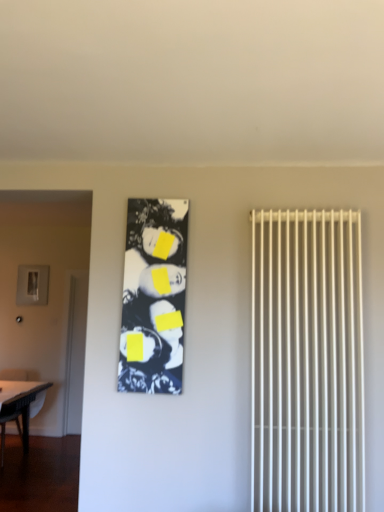
Image resolution: width=384 pixels, height=512 pixels. What do you see at coordinates (20, 405) in the screenshot?
I see `white glossy table at lower left` at bounding box center [20, 405].

Describe the element at coordinates (75, 353) in the screenshot. I see `matte gray screen door at left` at that location.

Where is `white glossy table at lower left`? The height and width of the screenshot is (512, 384). white glossy table at lower left is located at coordinates (20, 405).

Consider the image. Considering the relative sizes of white glossy table at lower left and white plastic radiator at right in the image provided, is white glossy table at lower left bigger than white plastic radiator at right?

Yes.

From a real-world perspective, is white glossy table at lower left positioned above or below white plastic radiator at right?

white glossy table at lower left is situated lower than white plastic radiator at right in the real world.

This screenshot has width=384, height=512. In order to click on table on the left of white plastic radiator at right in this screenshot , I will do `click(20, 405)`.

Between white glossy table at lower left and white plastic radiator at right, which one has less height?

Standing shorter between the two is white glossy table at lower left.

Does white plastic radiator at right have a greater width compared to black glossy photo frame at center?

Yes.

Is white plastic radiator at right not within black glossy photo frame at center?

Yes, white plastic radiator at right is outside of black glossy photo frame at center.

Considering the points (335, 246) and (161, 309), which point is in front, point (335, 246) or point (161, 309)?

Positioned in front is point (335, 246).

Considering the relative sizes of white glossy table at lower left and black glossy photo frame at center in the image provided, is white glossy table at lower left thinner than black glossy photo frame at center?

Incorrect, the width of white glossy table at lower left is not less than that of black glossy photo frame at center.

Considering the positions of objects white glossy table at lower left and black glossy photo frame at center in the image provided, who is more to the left, white glossy table at lower left or black glossy photo frame at center?

white glossy table at lower left.

Is the position of white glossy table at lower left more distant than that of black glossy photo frame at center?

Yes, white glossy table at lower left is further from the viewer.

Which of these two, white glossy table at lower left or black glossy photo frame at center, is bigger?

With larger size is white glossy table at lower left.

Visually, is white glossy table at lower left positioned to the left or to the right of matte gray screen door at left?

Clearly, white glossy table at lower left is on the left of matte gray screen door at left in the image.

In the scene shown: Based on their sizes in the image, would you say white glossy table at lower left is bigger or smaller than matte gray screen door at left?

Clearly, white glossy table at lower left is larger in size than matte gray screen door at left.

Is white glossy table at lower left facing towards matte gray screen door at left?

No, white glossy table at lower left is not aimed at matte gray screen door at left.

Is white glossy table at lower left closer to the viewer compared to matte gray screen door at left?

That is True.

Based on their sizes in the image, would you say matte gray screen door at left is bigger or smaller than white plastic radiator at right?

In the image, matte gray screen door at left appears to be smaller than white plastic radiator at right.

From the image's perspective, is matte gray screen door at left below white plastic radiator at right?

Yes.

Which object is wider, matte gray screen door at left or white plastic radiator at right?

With larger width is white plastic radiator at right.

Is matte gray screen door at left taller or shorter than white plastic radiator at right?

Considering their sizes, matte gray screen door at left has more height than white plastic radiator at right.

Image resolution: width=384 pixels, height=512 pixels. I want to click on table lying in front of the matte gray screen door at left, so click(x=20, y=405).

From a real-world perspective, is matte gray screen door at left positioned under white glossy table at lower left based on gravity?

No, from a real-world perspective, matte gray screen door at left is not below white glossy table at lower left.

Looking at this image, does matte gray screen door at left touch white glossy table at lower left?

No, matte gray screen door at left is not beside white glossy table at lower left.

From the image's perspective, is black glossy photo frame at center located above or below white plastic radiator at right?

black glossy photo frame at center is situated higher than white plastic radiator at right in the image.

Is black glossy photo frame at center further to camera compared to white plastic radiator at right?

Yes, black glossy photo frame at center is further from the viewer.

In terms of width, does black glossy photo frame at center look wider or thinner when compared to white plastic radiator at right?

Considering their sizes, black glossy photo frame at center looks slimmer than white plastic radiator at right.

Is white plastic radiator at right at the back of black glossy photo frame at center?

No, white plastic radiator at right is not at the back of black glossy photo frame at center.

You are a GUI agent. You are given a task and a screenshot of the screen. Output one action in this format:
    pyautogui.click(x=<x>, y=<y>)
    Task: Click on the radiator that is in front of the white glossy table at lower left
    This screenshot has height=512, width=384.
    Given the screenshot: What is the action you would take?
    pyautogui.click(x=307, y=362)

Identify the location of radiator directly beneath the black glossy photo frame at center (from a real-world perspective). This screenshot has width=384, height=512. (307, 362).

Which object lies further to the anchor point matte gray screen door at left, white plastic radiator at right or black glossy photo frame at center?

white plastic radiator at right is further to matte gray screen door at left.

From the image, which object appears to be nearer to white glossy table at lower left, white plastic radiator at right or matte gray screen door at left?

Among the two, matte gray screen door at left is located nearer to white glossy table at lower left.

Estimate the real-world distances between objects in this image. Which object is further from black glossy photo frame at center, white plastic radiator at right or matte gray screen door at left?

matte gray screen door at left lies further to black glossy photo frame at center than the other object.

Which object lies nearer to the anchor point matte gray screen door at left, white glossy table at lower left or black glossy photo frame at center?

Among the two, white glossy table at lower left is located nearer to matte gray screen door at left.

Looking at this image, looking at the image, which one is located further to black glossy photo frame at center, matte gray screen door at left or white plastic radiator at right?

Among the two, matte gray screen door at left is located further to black glossy photo frame at center.

From the picture: Based on their spatial positions, is white glossy table at lower left or white plastic radiator at right further from black glossy photo frame at center?

white glossy table at lower left lies further to black glossy photo frame at center than the other object.

Estimate the real-world distances between objects in this image. Which object is further from matte gray screen door at left, white glossy table at lower left or white plastic radiator at right?

Based on the image, white plastic radiator at right appears to be further to matte gray screen door at left.

Estimate the real-world distances between objects in this image. Which object is further from white plastic radiator at right, black glossy photo frame at center or white glossy table at lower left?

white glossy table at lower left lies further to white plastic radiator at right than the other object.

This screenshot has height=512, width=384. In order to click on couple located between white plastic radiator at right and matte gray screen door at left in the depth direction in this screenshot , I will do `click(154, 296)`.

The width and height of the screenshot is (384, 512). Identify the location of table between black glossy photo frame at center and matte gray screen door at left along the z-axis. (20, 405).

Identify the location of table between white plastic radiator at right and matte gray screen door at left in the front-back direction. (20, 405).

I want to click on couple between white plastic radiator at right and white glossy table at lower left from front to back, so click(x=154, y=296).